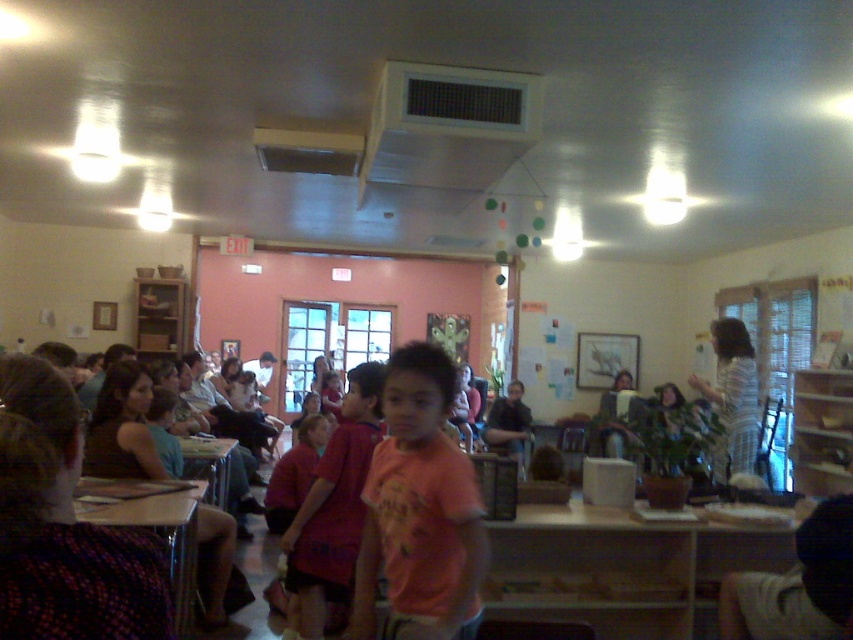
Question: Which object is farther from the camera taking this photo?

Choices:
 (A) pink cotton shirt at center
 (B) striped shirt at right
 (C) wooden desk at center

Answer: (C)

Question: Among these points, which one is nearest to the camera?

Choices:
 (A) (740, 416)
 (B) (363, 529)
 (C) (368, 461)

Answer: (B)

Question: Can you confirm if pink cotton shirt at center is positioned below pink fabric shirt at center?

Choices:
 (A) yes
 (B) no

Answer: (B)

Question: Which point is farther to the camera?

Choices:
 (A) (190, 444)
 (B) (480, 518)
 (C) (751, 412)

Answer: (A)

Question: Is pink fabric shirt at center bigger than striped shirt at right?

Choices:
 (A) no
 (B) yes

Answer: (A)

Question: Observing the image, what is the correct spatial positioning of pink fabric shirt at center in reference to wooden desk at center?

Choices:
 (A) left
 (B) right

Answer: (B)